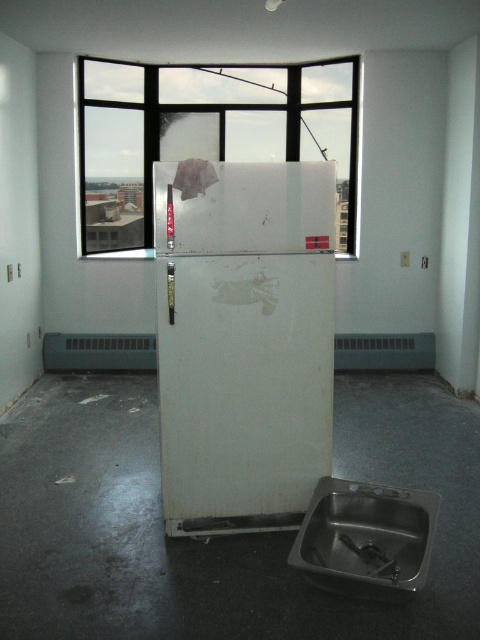
You are a delivery person trying to bring in a new appliance that is 1.5 meters wide. The white matte refrigerator at center is currently occupying space in the room. Can the new appliance fit through the transparent glass window at center based on their widths?

The white matte refrigerator at center is narrower than the transparent glass window at center, so the new appliance that is 1.5 meters wide may fit through the window if the refrigerator is moved or removed first. However, the exact dimensions of the window and the clearance needed should be considered for a definitive answer.

Looking at this image, you are a contractor assessing the space for a new kitchen installation. You need to determine if the transparent glass window at center and the stainless steel sink at lower right can fit side by side along the width of the room. Given that the total available width is 2.5 meters, can both items fit without overlapping?

The transparent glass window at center is wider than the stainless steel sink at lower right. Since the total available width is 2.5 meters, but the exact widths of each item are not provided, it is impossible to determine if they can fit side by side without overlapping based on the given information.

In the scene shown: You are a plumber trying to fix a leak under the sink. You need to access the pipes behind the stainless steel sink at lower right. However, the transparent glass window at center is blocking your view. Can you move the sink to the side to get a better angle?

The stainless steel sink at lower right is behind the transparent glass window at center, so you can move the sink to the side to access the pipes without obstruction from the window.